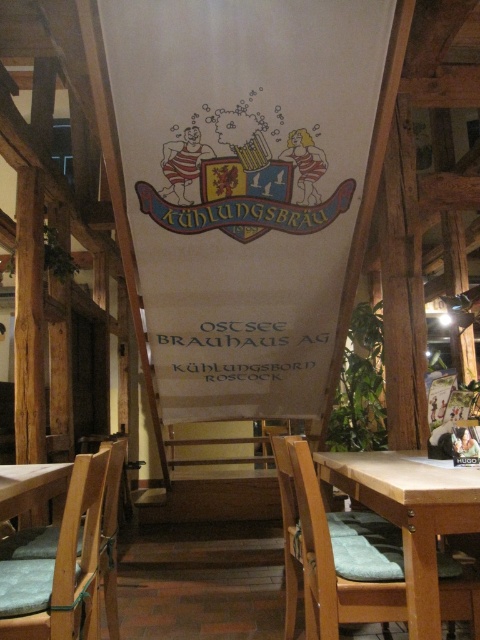
You are a customer sitting at the table with the green cushion. You want to reach the point marked at point (288,568) without moving your chair. Can you do it comfortably?

The distance between the customer and the point marked at point (288,568) is 2.40 meters, so it is possible to reach it without moving the chair, but it might require stretching or moving slightly, depending on the customer comfort level.

You are sitting at the rustic restaurant and want to move from the wooden chair at lower left to the wooden chair at center. Which direction should you move?

You should move to the right to reach the wooden chair at center from the wooden chair at lower left, as it is positioned to the right of it.

You are a photographer positioned at the entrance of the rustic restaurant. You want to take a photo that includes both the banner with the lion crest and the plants. The banner is located at point (295, 452) and the plants are at point (91, 513). Which point should you focus on first to ensure both are in sharp focus?

You should focus on point (295, 452) first because it is closer to the camera than point (91, 513). By focusing on the closer point, the depth of field may still keep the farther point in acceptable focus.